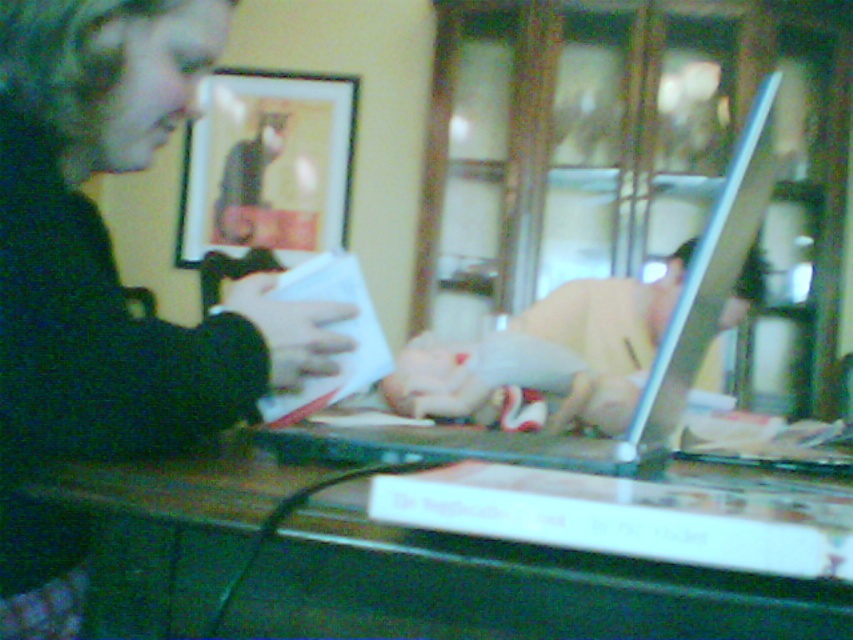
Which is more to the left, matte black laptop at upper right or wooden table at center?

matte black laptop at upper right

Does matte black laptop at upper right have a lesser width compared to wooden table at center?

Correct, matte black laptop at upper right's width is less than wooden table at center's.

Is point (13, 81) positioned after point (534, 554)?

Yes.

Locate an element on the screen. The image size is (853, 640). matte black laptop at upper right is located at coordinates (107, 280).

Is wooden table at center taller than matte black picture frame at upper center?

Answer: No.

The image size is (853, 640). I want to click on wooden table at center, so click(x=503, y=588).

Is point (196, 563) farther from viewer compared to point (329, 216)?

That is False.

You are a GUI agent. You are given a task and a screenshot of the screen. Output one action in this format:
    pyautogui.click(x=<x>, y=<y>)
    Task: Click on the wooden table at center
    This screenshot has height=640, width=853.
    Given the screenshot: What is the action you would take?
    pyautogui.click(x=503, y=588)

Which is more to the left, matte black picture frame at upper center or smooth beige shirt at center?

Positioned to the left is matte black picture frame at upper center.

Does matte black picture frame at upper center have a greater height compared to smooth beige shirt at center?

Correct, matte black picture frame at upper center is much taller as smooth beige shirt at center.

Is point (273, 172) in front of point (608, 376)?

That is False.

Identify the location of matte black picture frame at upper center. The height and width of the screenshot is (640, 853). (267, 164).